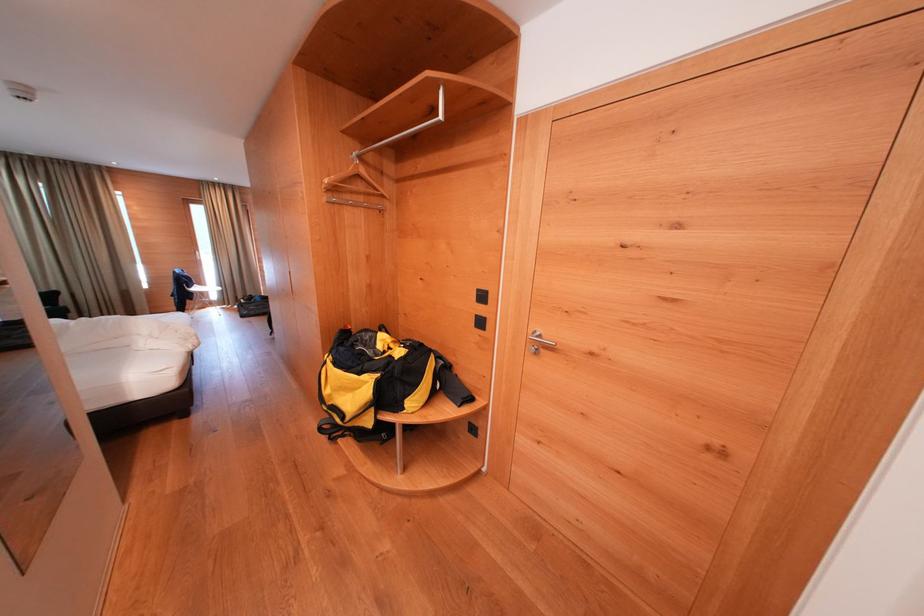
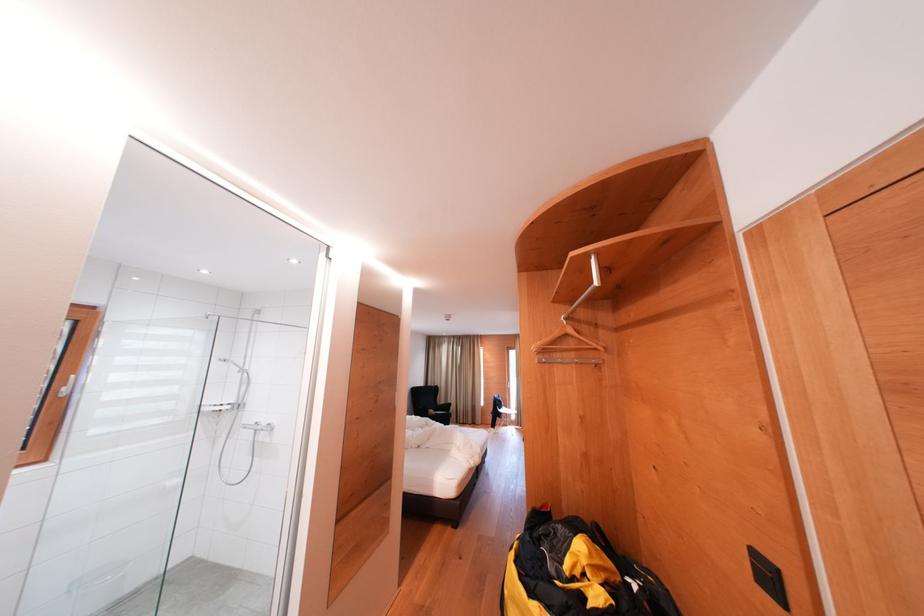
Find the pixel in the second image that matches the point at 490,301 in the first image.

(776, 582)